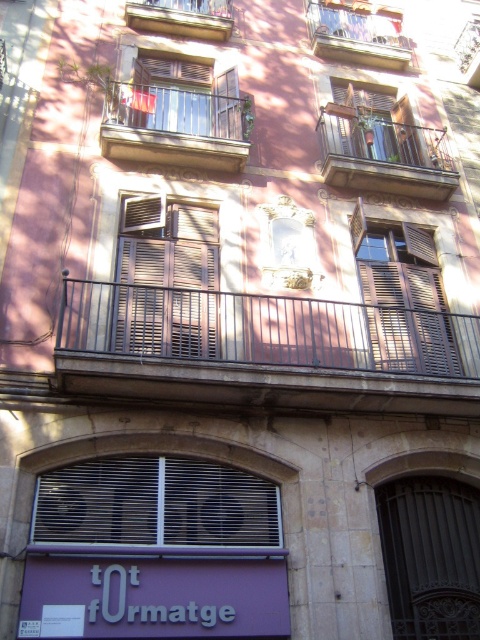
Question: Can you confirm if metallic gray balcony at center is thinner than metallic balcony at upper center?

Choices:
 (A) yes
 (B) no

Answer: (B)

Question: Which object is the closest to the metallic gray balcony at center?

Choices:
 (A) metallic black balcony at center
 (B) wooden brown balcony at upper center

Answer: (A)

Question: Does metallic black balcony at center appear over metallic balcony at upper center?

Choices:
 (A) no
 (B) yes

Answer: (A)

Question: Can you confirm if metallic silver balcony at upper center is bigger than metallic balcony at upper center?

Choices:
 (A) yes
 (B) no

Answer: (B)

Question: Which is farther from the metallic silver balcony at upper center?

Choices:
 (A) metallic balcony at upper center
 (B) metallic gray balcony at center
 (C) metallic black balcony at center

Answer: (A)

Question: Which of the following is the closest to the observer?

Choices:
 (A) (344, 170)
 (B) (317, 42)
 (C) (191, 307)
 (D) (131, 138)

Answer: (C)